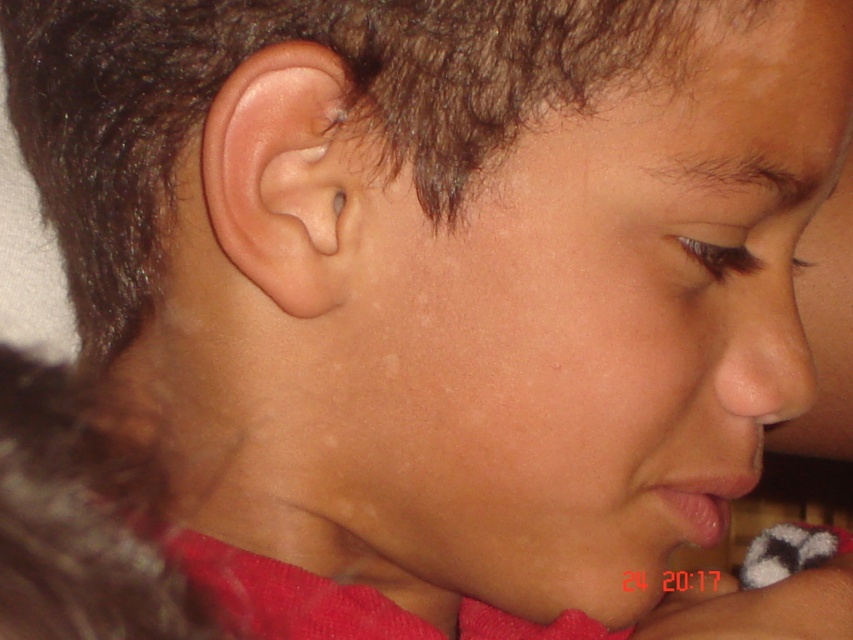
Question: Does dark brown hair at upper center have a greater width compared to pink matte lips at lower center?

Choices:
 (A) yes
 (B) no

Answer: (A)

Question: Considering the real-world distances, which object is closest to the smooth skin face at center?

Choices:
 (A) dark brown hair at upper center
 (B) matte skin nose at right

Answer: (B)

Question: Which point is closer to the camera?

Choices:
 (A) smooth skin face at center
 (B) pink matte lips at lower center

Answer: (A)

Question: Does dark brown hair at upper center lie behind pink matte lips at lower center?

Choices:
 (A) no
 (B) yes

Answer: (A)

Question: Is pink flesh-colored ear at left below pink matte lips at lower center?

Choices:
 (A) no
 (B) yes

Answer: (A)

Question: Among these points, which one is farthest from the camera?

Choices:
 (A) (793, 3)
 (B) (720, 376)
 (C) (704, 545)
 (D) (335, 188)

Answer: (C)